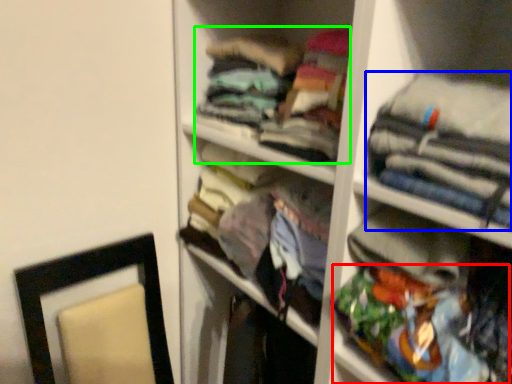
Question: Which is farther away from clothing (highlighted by a red box)? clothing (highlighted by a blue box) or clothing (highlighted by a green box)?

Choices:
 (A) clothing
 (B) clothing

Answer: (B)